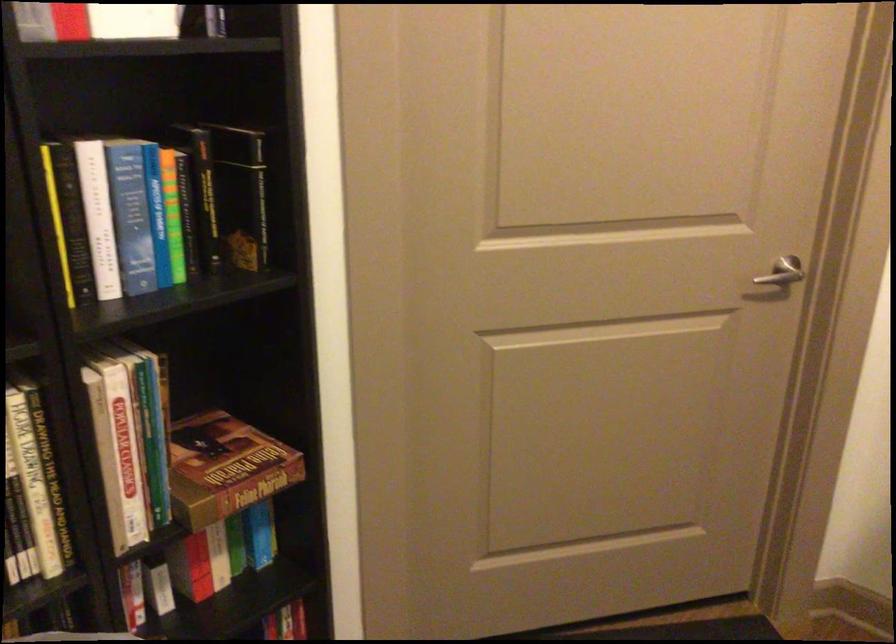
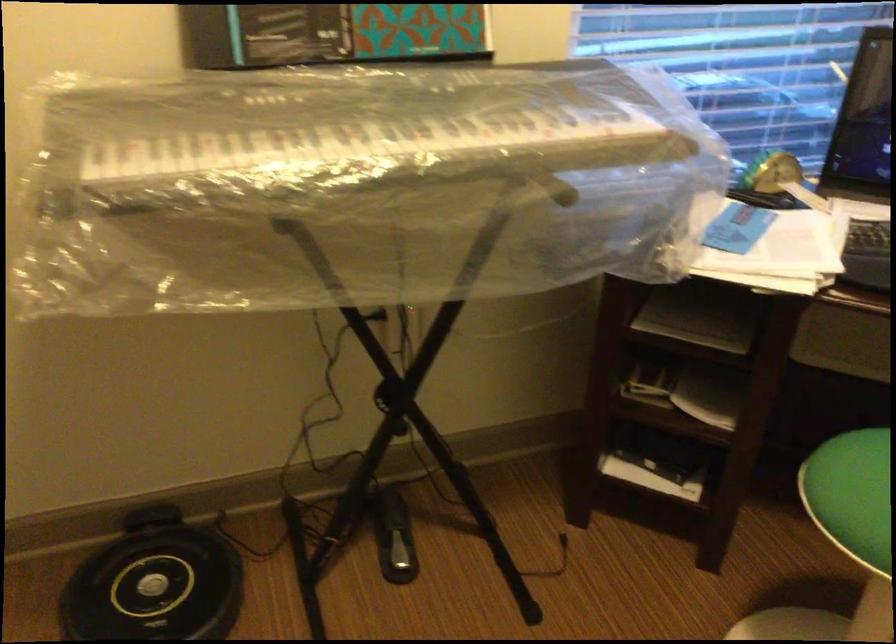
The images are taken continuously from a first-person perspective. In which direction is your viewpoint rotating?

The camera rotated toward right-down.